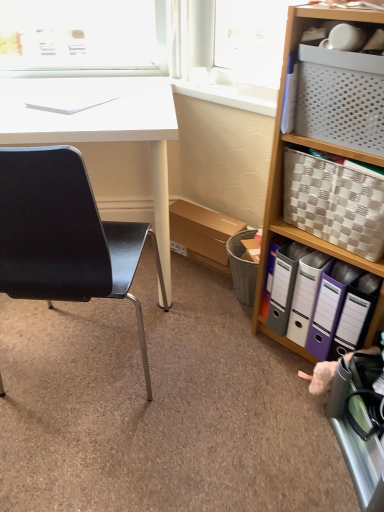
Locate an element on the screen. The width and height of the screenshot is (384, 512). free point below black matte chair at left (from a real-world perspective) is located at coordinates (72, 366).